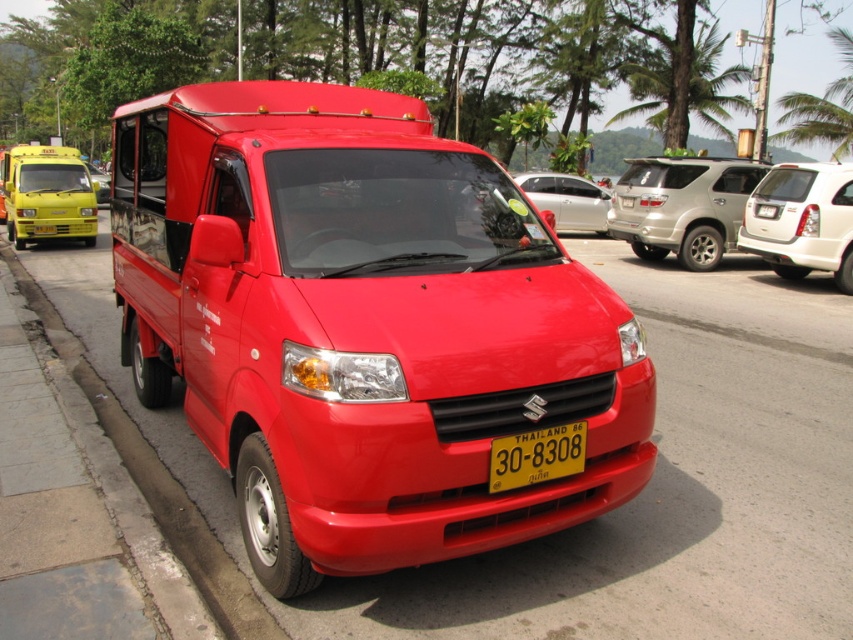
Question: Does yellow matte taxi at left appear under yellow matte license plate at center?

Choices:
 (A) no
 (B) yes

Answer: (A)

Question: Among these points, which one is nearest to the camera?

Choices:
 (A) (577, 180)
 (B) (83, 180)
 (C) (567, 298)
 (D) (548, 468)

Answer: (D)

Question: Estimate the real-world distances between objects in this image. Which object is farther from the yellow matte taxi at left?

Choices:
 (A) white glossy minivan at right
 (B) yellow matte license plate at center
 (C) silver metallic suv at center-right
 (D) matte red truck at center

Answer: (B)

Question: Where is matte red truck at center located in relation to yellow matte taxi at left in the image?

Choices:
 (A) right
 (B) left

Answer: (A)

Question: Based on their relative distances, which object is nearer to the white glossy minivan at right?

Choices:
 (A) silver metallic suv at center-right
 (B) silver metallic sedan at center

Answer: (A)

Question: Is white glossy minivan at right behind yellow matte license plate at center?

Choices:
 (A) no
 (B) yes

Answer: (B)